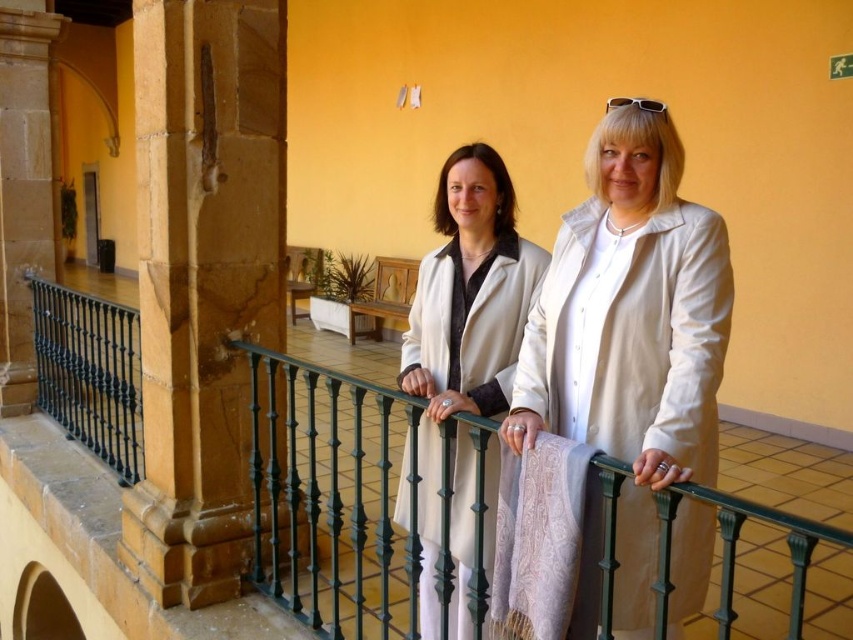
Question: Which point appears farthest from the camera in this image?

Choices:
 (A) (305, 332)
 (B) (44, 24)
 (C) (445, 360)
 (D) (671, 227)

Answer: (A)

Question: Does black wrought iron at center have a lesser width compared to matte white coat at center?

Choices:
 (A) no
 (B) yes

Answer: (B)

Question: Which object appears closest to the camera in this image?

Choices:
 (A) black wrought iron at center
 (B) sandy stone pillar at left

Answer: (A)

Question: Which of the following is the closest to the observer?

Choices:
 (A) light beige fabric coat at center
 (B) marble column at left

Answer: (A)

Question: Does marble column at left have a smaller size compared to light beige fabric coat at center?

Choices:
 (A) yes
 (B) no

Answer: (B)

Question: In this image, where is marble column at left located relative to light beige fabric coat at center?

Choices:
 (A) below
 (B) above

Answer: (B)